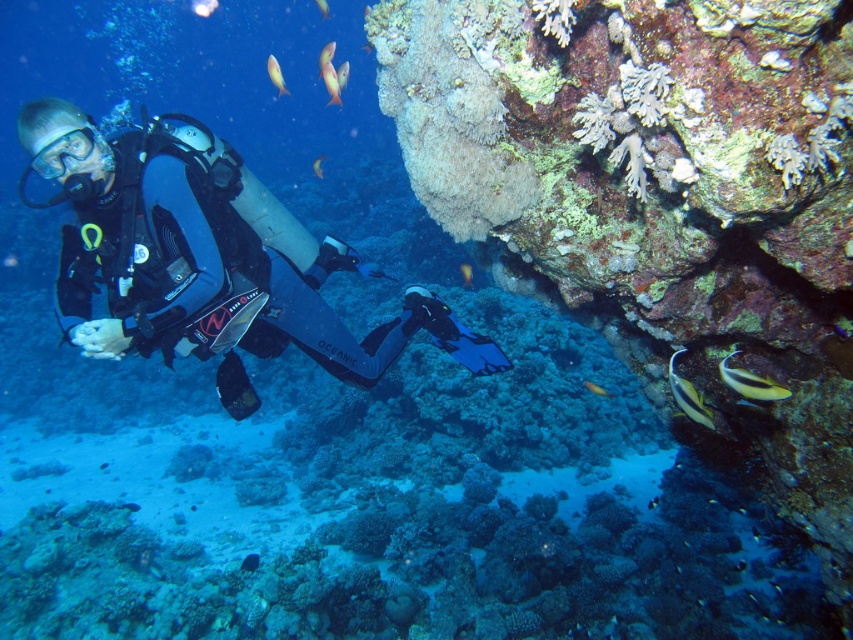
Question: Which object is the farthest from the yellow matte fish at upper center?

Choices:
 (A) orange glossy fish at upper center
 (B) yellow matte fish at center
 (C) yellow and black striped fish at lower right

Answer: (C)

Question: Is matte black goggles at upper left to the left of shiny silver fish at upper center from the viewer's perspective?

Choices:
 (A) no
 (B) yes

Answer: (A)

Question: Which object is positioned farthest from the shiny silver fish at upper center?

Choices:
 (A) yellow-green glossy fish at lower right
 (B) translucent blue fish at center
 (C) translucent pinkish-orange fish at upper center

Answer: (A)

Question: Considering the relative positions of yellow matte fish at upper center and translucent pinkish-orange fish at upper center in the image provided, where is yellow matte fish at upper center located with respect to translucent pinkish-orange fish at upper center?

Choices:
 (A) right
 (B) left

Answer: (B)

Question: Estimate the real-world distances between objects in this image. Which object is closer to the shiny orange fish at upper center?

Choices:
 (A) yellow and black striped fish at lower right
 (B) shiny blue fish at center

Answer: (B)

Question: Can you confirm if yellow matte fish at upper center is positioned above translucent blue fish at center?

Choices:
 (A) no
 (B) yes

Answer: (A)